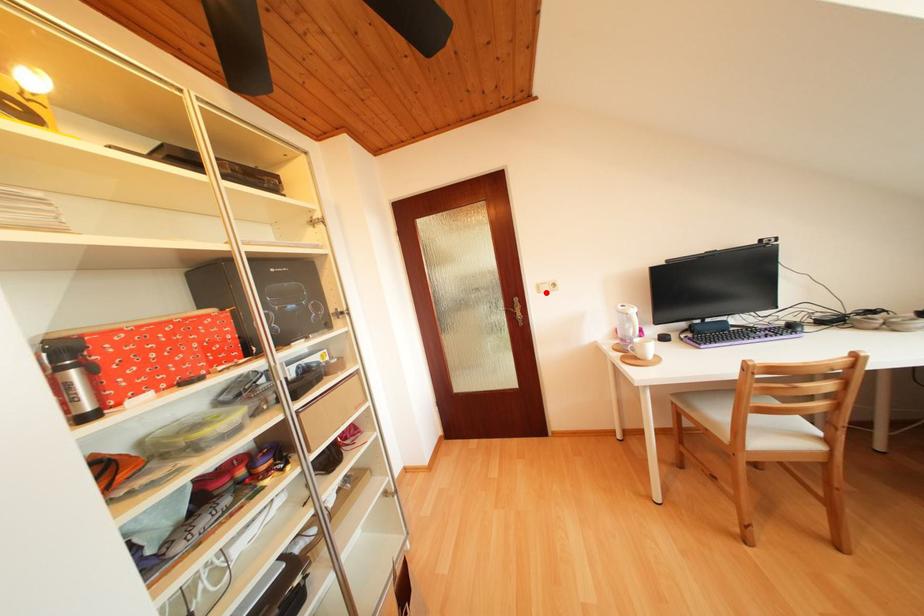
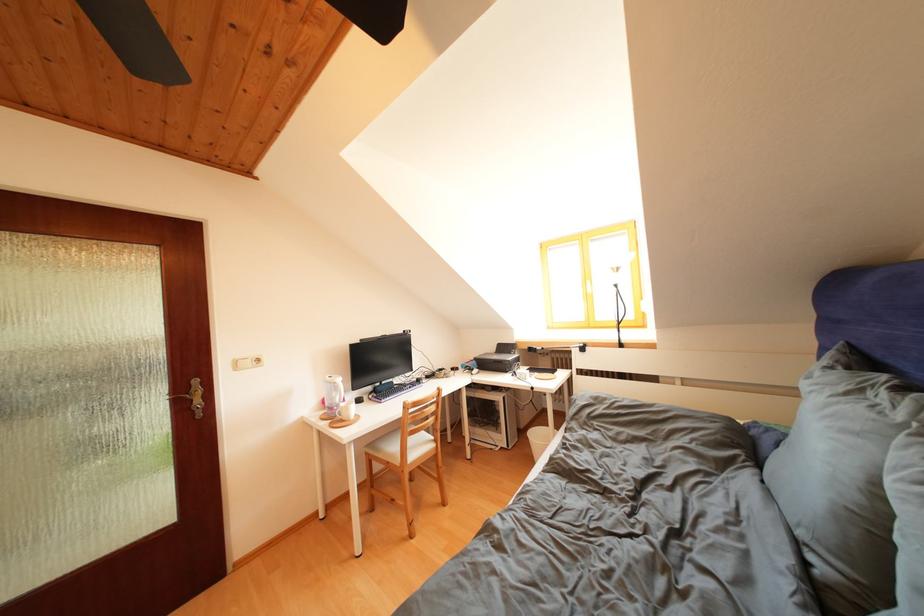
Where in the second image is the point corresponding to the highlighted location from the first image?

(244, 369)